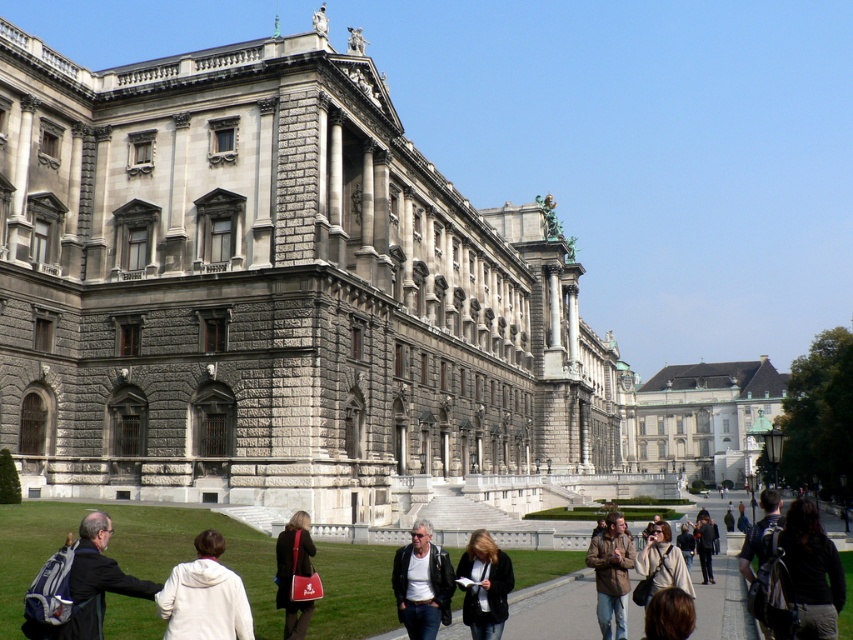
Is black leather jacket at lower center thinner than beige silk kimono at center?

In fact, black leather jacket at lower center might be wider than beige silk kimono at center.

Can you confirm if black leather jacket at lower center is positioned to the right of beige silk kimono at center?

Incorrect, black leather jacket at lower center is not on the right side of beige silk kimono at center.

Is point (410, 579) positioned in front of point (662, 570)?

Yes.

At what (x,y) coordinates should I click in order to perform the action: click on black leather jacket at lower center. Please return your answer as a coordinate pair (x, y). Looking at the image, I should click on (422, 582).

Consider the image. Who is taller, concrete pathway at center or denim jacket at lower center?

Standing taller between the two is concrete pathway at center.

Is point (543, 630) farther from camera compared to point (469, 566)?

Yes, it is.

In order to click on concrete pathway at center in this screenshot , I will do `click(554, 609)`.

Which is below, beige silk kimono at center or dark brown leather jacket at center?

dark brown leather jacket at center

Who is more distant from viewer, (672, 552) or (711, 557)?

Positioned behind is point (711, 557).

The image size is (853, 640). I want to click on beige silk kimono at center, so click(x=662, y=563).